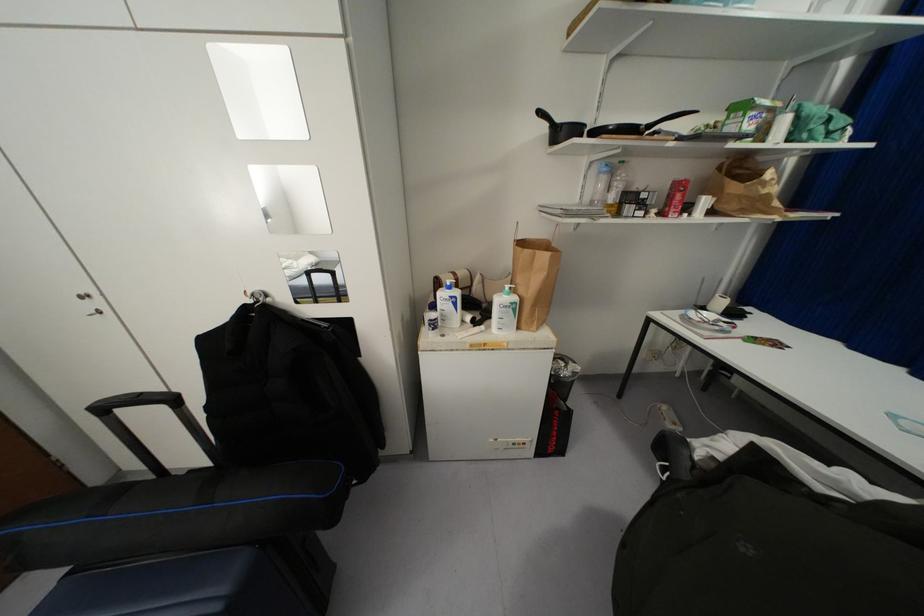
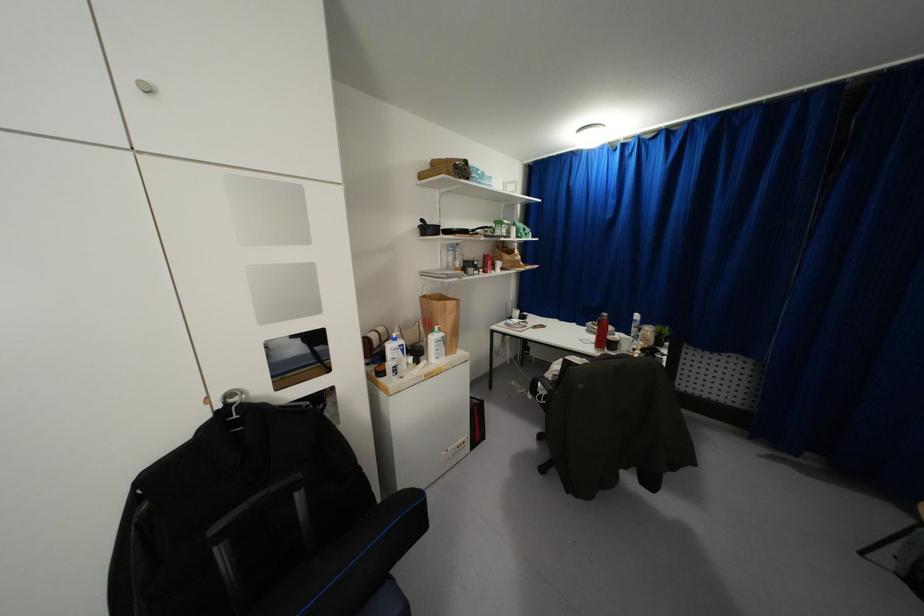
Locate, in the second image, the point that corresponds to point 541,113 in the first image.

(421, 220)